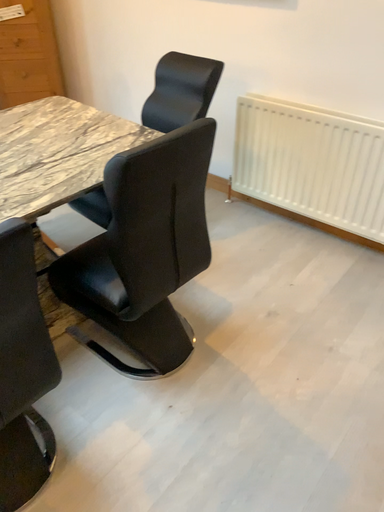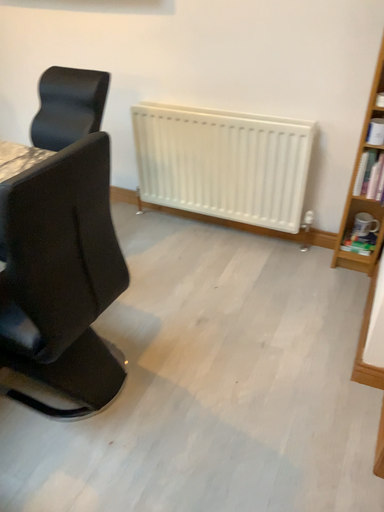
Question: Which way did the camera rotate in the video?

Choices:
 (A) rotated right
 (B) rotated left

Answer: (A)